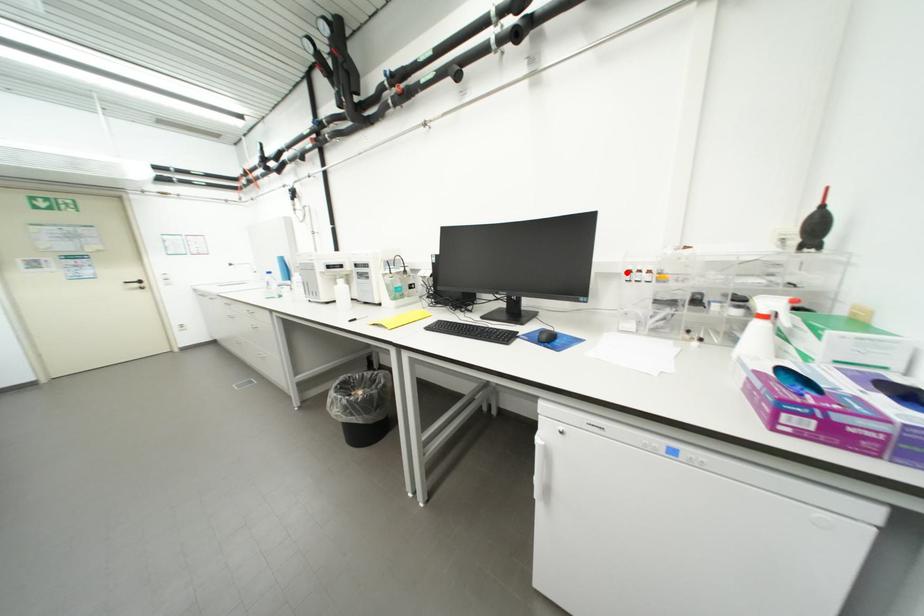
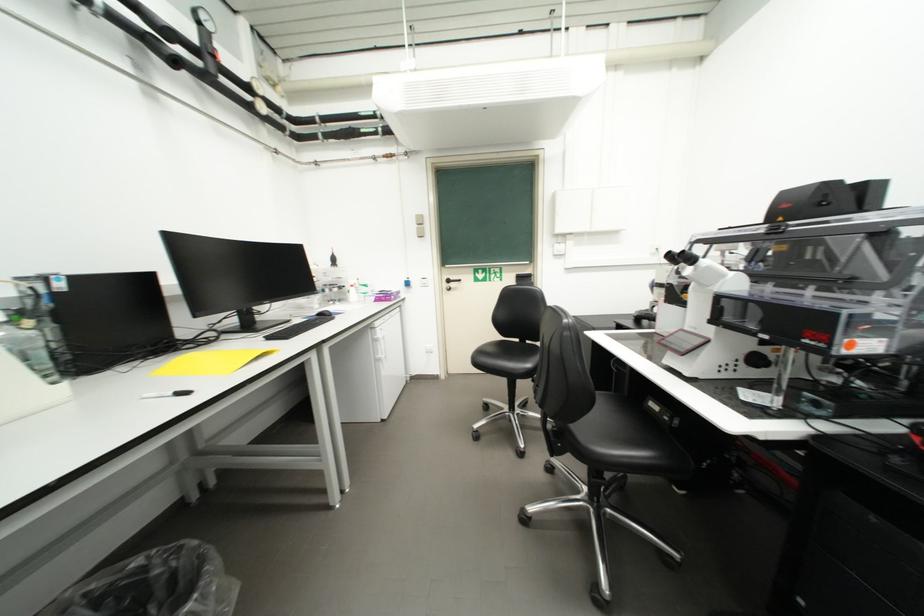
Question: I am providing you with two images of the same scene from different viewpoints. A red point is marked on the first image. At the location where the point appears in image 1, is it still visible in image 2?

Choices:
 (A) Yes
 (B) No

Answer: (B)